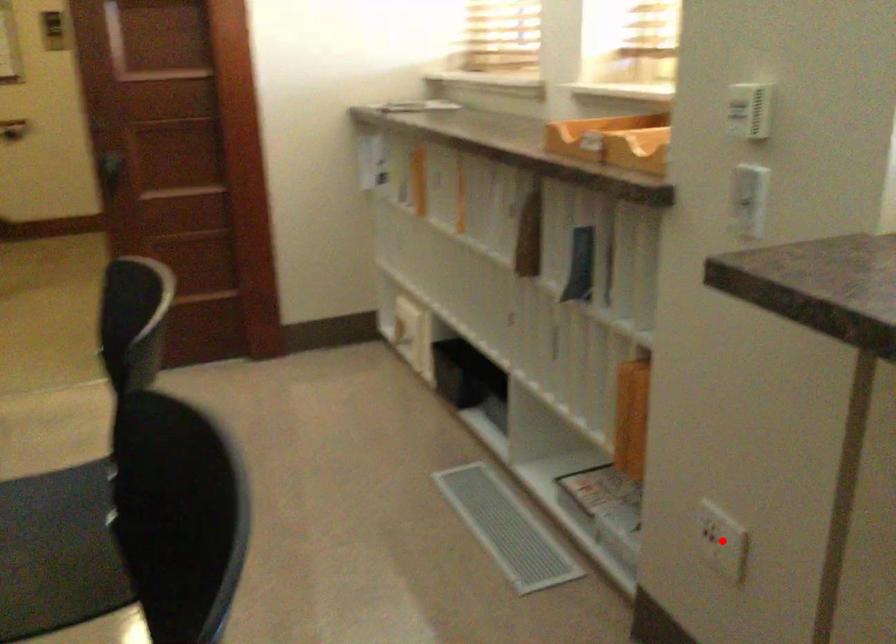
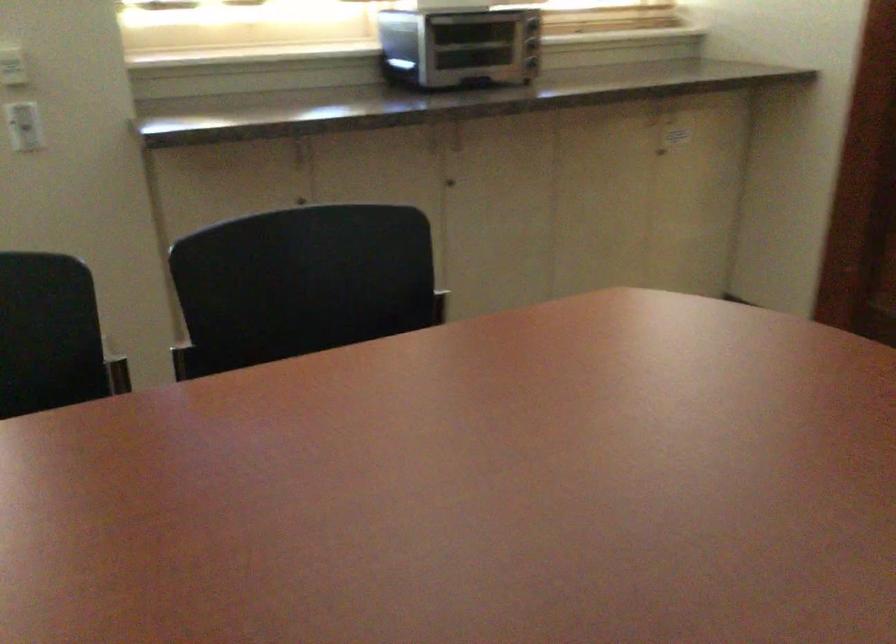
Question: I am providing you with two images of the same scene from different viewpoints. A red point is marked on the first image. Is the red point's position out of view in image 2?

Choices:
 (A) Yes
 (B) No

Answer: (A)